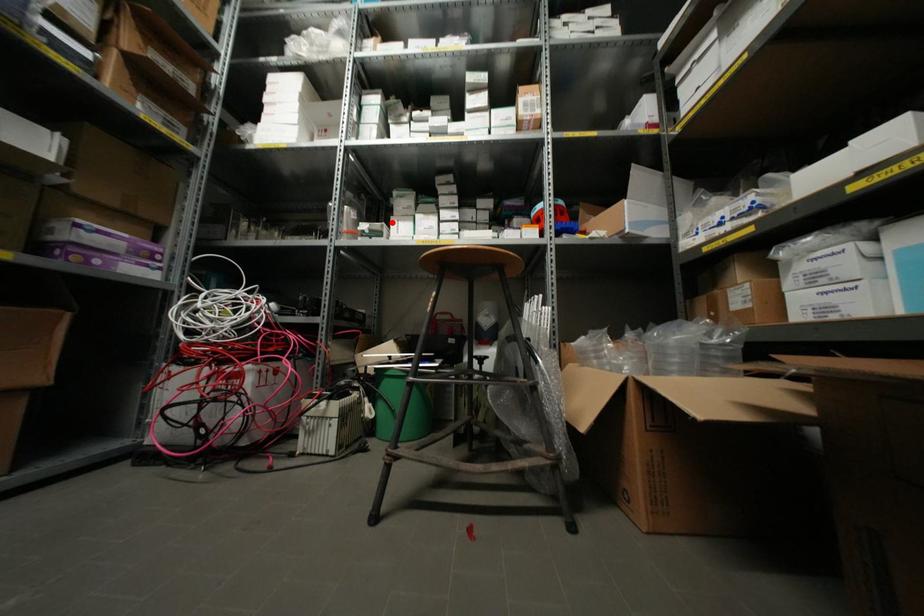
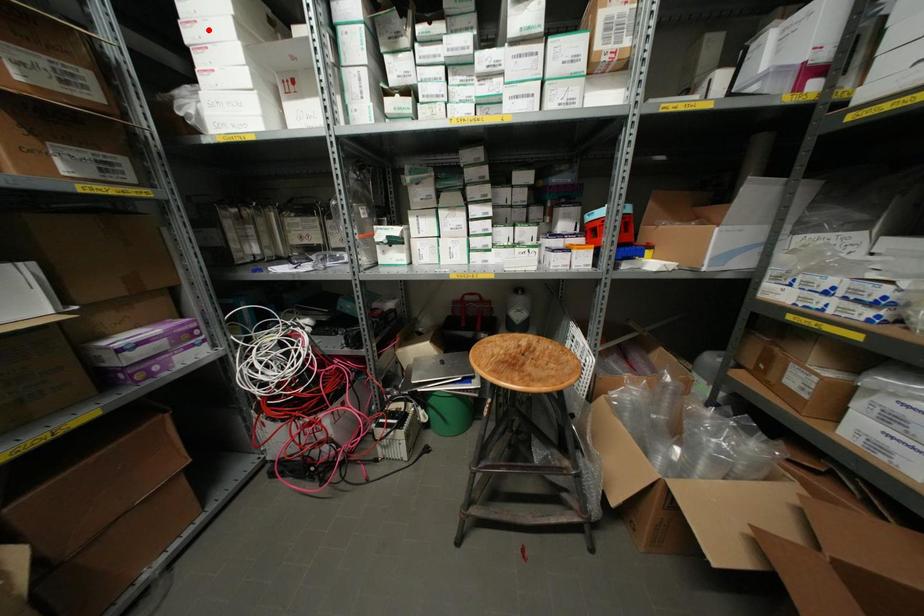
Looking at this image, I am providing you with two images of the same scene from different viewpoints. A red point is marked on the first image and another point is marked on the second image. Is the red point in image1 aligned with the point shown in image2?

No